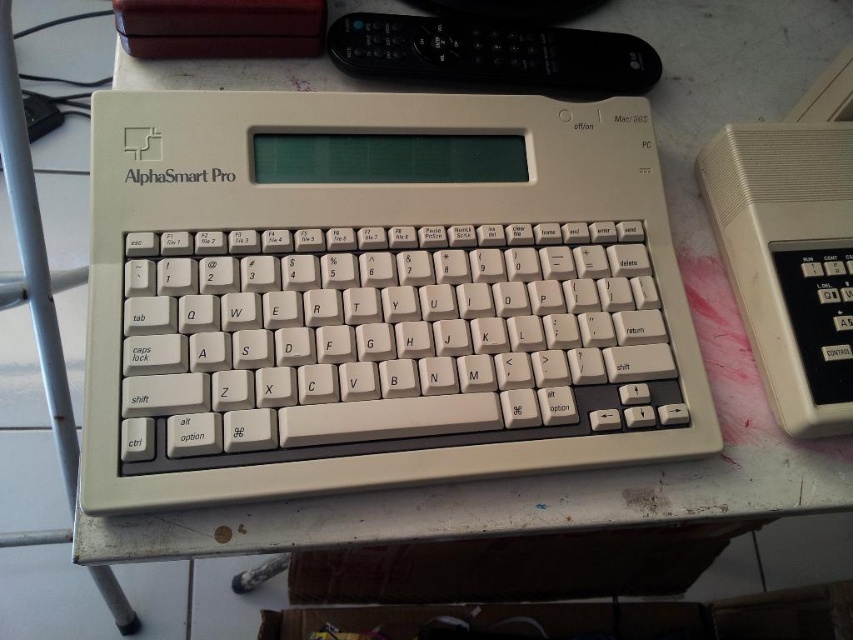
Between beige plastic calculator at right and black plastic remote at upper center, which one is positioned higher?

black plastic remote at upper center

Can you confirm if beige plastic calculator at right is positioned to the right of black plastic remote at upper center?

Yes, beige plastic calculator at right is to the right of black plastic remote at upper center.

Locate an element on the screen. The width and height of the screenshot is (853, 640). beige plastic calculator at right is located at coordinates (791, 248).